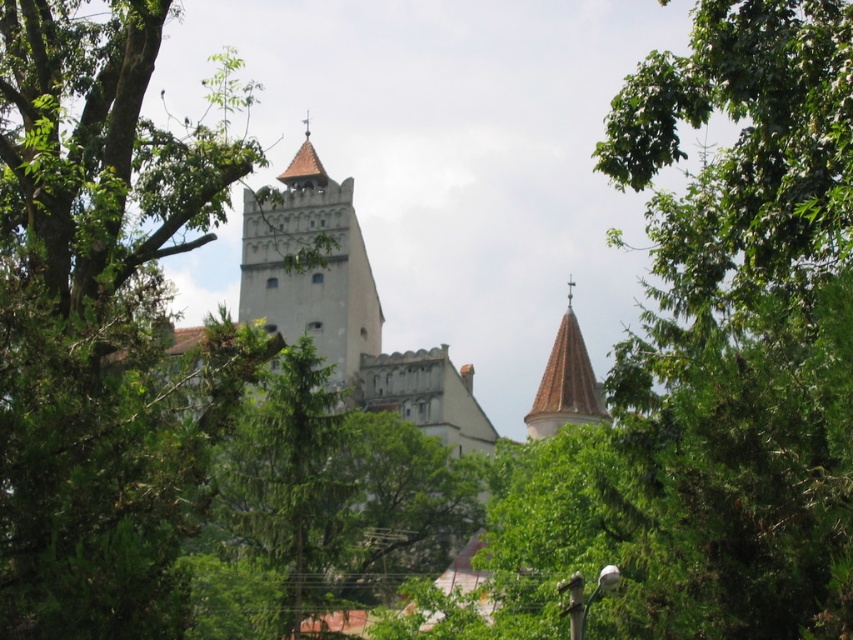
Question: In this image, where is green leafy tree at center located relative to white stone tower at center?

Choices:
 (A) left
 (B) right

Answer: (A)

Question: Which of the following is the closest to the observer?

Choices:
 (A) white stone tower at center
 (B) green leafy tree at center
 (C) white stucco tower at upper center

Answer: (B)

Question: Is green leafy tree at center positioned in front of white stone tower at center?

Choices:
 (A) no
 (B) yes

Answer: (B)

Question: Which is farther from the green leafy tree at center?

Choices:
 (A) white stone tower at center
 (B) white stucco tower at upper center

Answer: (B)

Question: Is white stone tower at center above white stucco tower at upper center?

Choices:
 (A) no
 (B) yes

Answer: (B)

Question: Which of the following is the farthest from the observer?

Choices:
 (A) (74, 493)
 (B) (312, 317)
 (C) (567, 394)

Answer: (B)